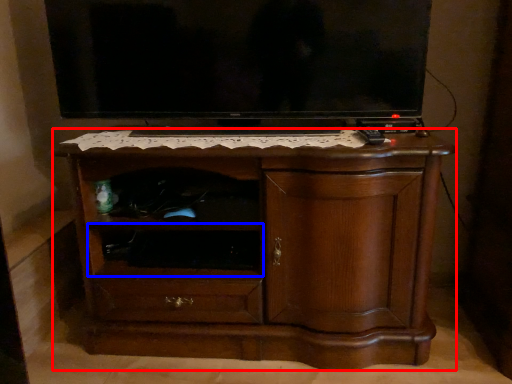
Question: Which object is further to the camera taking this photo, chest of drawers (highlighted by a red box) or shelf (highlighted by a blue box)?

Choices:
 (A) chest of drawers
 (B) shelf

Answer: (B)